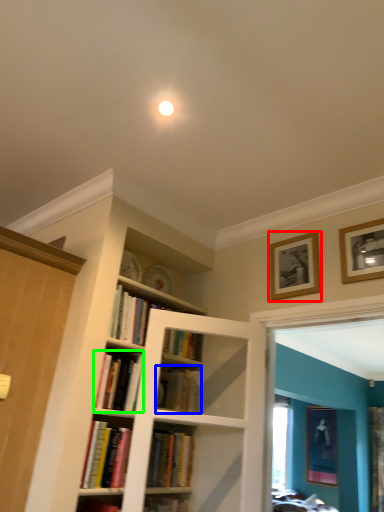
Question: Which object is positioned farthest from picture frame (highlighted by a red box)? Select from book (highlighted by a blue box) and book (highlighted by a green box).

Choices:
 (A) book
 (B) book

Answer: (B)